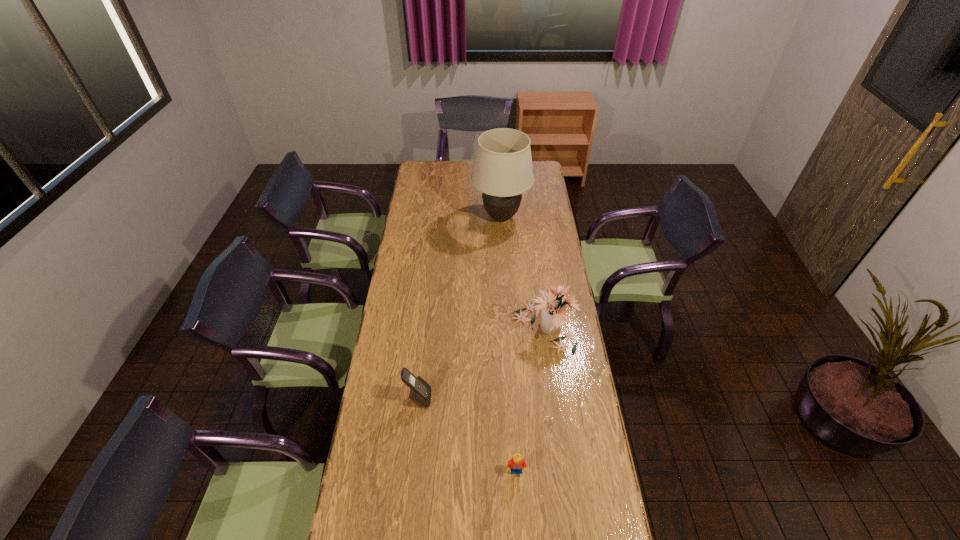
Where is `the tallest object`? the tallest object is located at coordinates (503, 170).

Locate an element on the screen. This screenshot has width=960, height=540. the farthest object is located at coordinates (503, 170).

At what (x,y) coordinates should I click in order to perform the action: click on the second tallest object. Please return your answer as a coordinate pair (x, y). This screenshot has width=960, height=540. Looking at the image, I should click on (553, 314).

The width and height of the screenshot is (960, 540). In order to click on bouquet in this screenshot , I will do (553, 314).

This screenshot has height=540, width=960. I want to click on the third farthest object, so click(420, 391).

The image size is (960, 540). I want to click on the leftmost object, so click(x=420, y=391).

Locate an element on the screen. the nearest object is located at coordinates (515, 465).

Where is `the shortest object`? This screenshot has width=960, height=540. the shortest object is located at coordinates (515, 465).

Find the location of a particular element. free space located on the back of the farthest object is located at coordinates [x=498, y=165].

Find the location of a particular element. vacant region located 0.090m on the front of the third nearest object is located at coordinates (550, 375).